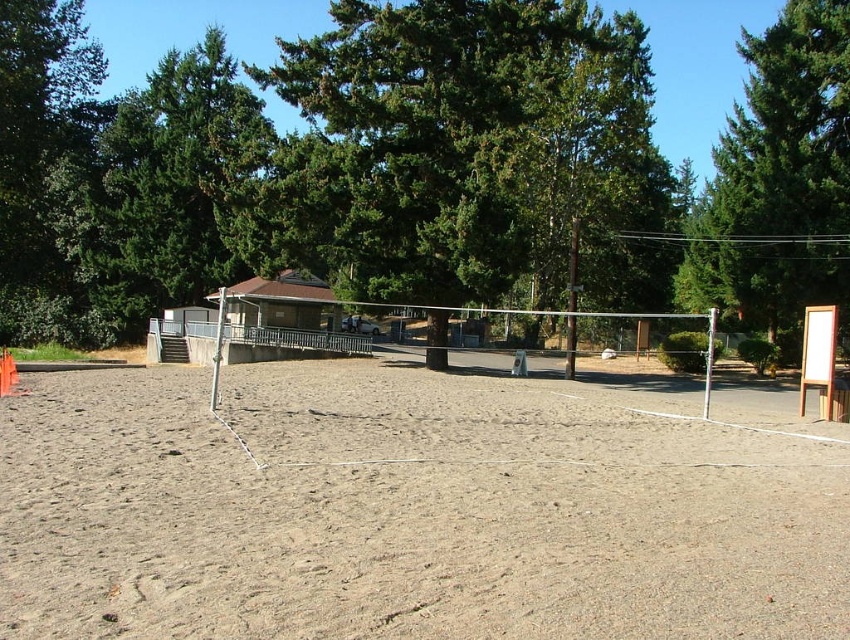
You are standing at the center of the volleyball court. You want to walk towards the green leafy tree at center. Which direction should you walk?

The green leafy tree at center is located at point coordinates of (460, 152). Since you are at the center of the court, you should walk towards the direction of the coordinates to reach the tree.

You are standing on the brown sandy beach at center and want to throw a ball to a friend standing under the green textured tree at upper right. If the ball can travel 20 meters, will it reach your friend?

The distance between the brown sandy beach at center and the green textured tree at upper right is 25.61 meters, which is farther than the ball can travel 20 meters. The ball will not reach your friend.